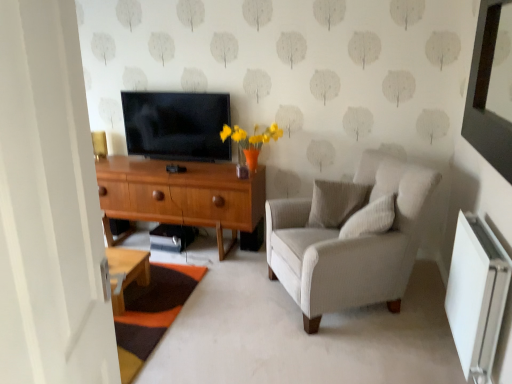
Question: Could matte black tv at center be considered to be inside white textured pillow at center, marked as the 2th pillow in a front-to-back arrangement?

Choices:
 (A) yes
 (B) no

Answer: (B)

Question: Is white textured pillow at center, marked as the 2th pillow in a front-to-back arrangement, facing towards matte black tv at center?

Choices:
 (A) no
 (B) yes

Answer: (A)

Question: Is white textured pillow at center, marked as the 2th pillow in a front-to-back arrangement, wider than matte black tv at center?

Choices:
 (A) no
 (B) yes

Answer: (B)

Question: Is white textured pillow at center, marked as the 2th pillow in a front-to-back arrangement, not close to matte black tv at center?

Choices:
 (A) yes
 (B) no

Answer: (A)

Question: Considering the relative positions of white textured pillow at center, marked as the 2th pillow in a front-to-back arrangement, and matte black tv at center in the image provided, is white textured pillow at center, marked as the 2th pillow in a front-to-back arrangement, behind matte black tv at center?

Choices:
 (A) yes
 (B) no

Answer: (B)

Question: In terms of height, does wooden desk at center look taller or shorter compared to light gray fabric armchair at right?

Choices:
 (A) tall
 (B) short

Answer: (B)

Question: Is wooden desk at center inside the boundaries of light gray fabric armchair at right, or outside?

Choices:
 (A) inside
 (B) outside

Answer: (B)

Question: In the image, is wooden desk at center on the left side or the right side of light gray fabric armchair at right?

Choices:
 (A) right
 (B) left

Answer: (B)

Question: Considering the positions of point (185, 221) and point (379, 163), is point (185, 221) closer or farther from the camera than point (379, 163)?

Choices:
 (A) farther
 (B) closer

Answer: (A)

Question: In terms of height, does white textured pillow at upper right, the 2th pillow from the back, look taller or shorter compared to light gray fabric armchair at right?

Choices:
 (A) tall
 (B) short

Answer: (B)

Question: Is white textured pillow at upper right, marked as the first pillow in a front-to-back arrangement, bigger or smaller than light gray fabric armchair at right?

Choices:
 (A) small
 (B) big

Answer: (A)

Question: Is white textured pillow at upper right, marked as the first pillow in a front-to-back arrangement, to the left or to the right of light gray fabric armchair at right in the image?

Choices:
 (A) right
 (B) left

Answer: (A)

Question: Is white textured pillow at upper right, the 2th pillow from the back, wider or thinner than light gray fabric armchair at right?

Choices:
 (A) wide
 (B) thin

Answer: (B)

Question: In terms of size, does matte black tv at center appear bigger or smaller than wooden desk at center?

Choices:
 (A) small
 (B) big

Answer: (A)

Question: From the image's perspective, relative to wooden desk at center, is matte black tv at center above or below?

Choices:
 (A) below
 (B) above

Answer: (B)